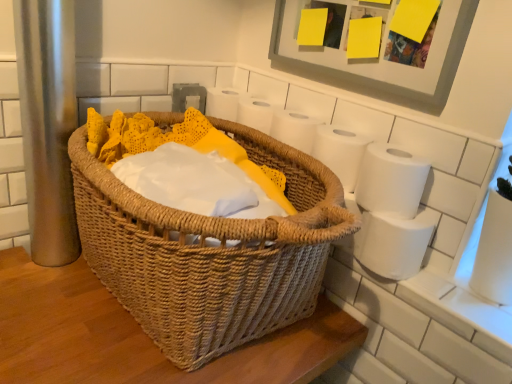
Question: Is woven brown picnic basket at center inside or outside of matte gray picture frame at upper right?

Choices:
 (A) inside
 (B) outside

Answer: (B)

Question: Is woven brown picnic basket at center taller or shorter than matte gray picture frame at upper right?

Choices:
 (A) short
 (B) tall

Answer: (B)

Question: Which object is positioned farthest from the white matte toilet paper at right, placed as the first toilet paper when sorted from bottom to top?

Choices:
 (A) matte gray picture frame at upper right
 (B) white matte toilet paper at upper right, arranged as the first toilet paper when viewed from the top
 (C) woven brown picnic basket at center
 (D) white matte toilet paper at right, which is counted as the second toilet paper, starting from the bottom

Answer: (A)

Question: Considering the real-world distances, which object is closest to the matte gray picture frame at upper right?

Choices:
 (A) white matte toilet paper at right, which is counted as the third toilet paper, starting from the top
 (B) white matte toilet paper at right, acting as the 2th toilet paper starting from the top
 (C) woven brown picnic basket at center
 (D) white matte toilet paper at upper right, acting as the third toilet paper starting from the bottom

Answer: (D)